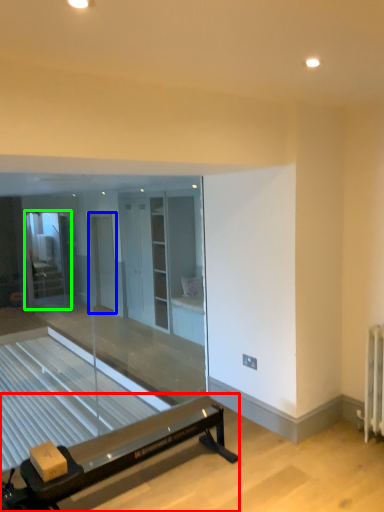
Question: Based on their relative distances, which object is nearer to furniture (highlighted by a red box)? Choose from screen door (highlighted by a blue box) and glass door (highlighted by a green box).

Choices:
 (A) screen door
 (B) glass door

Answer: (A)